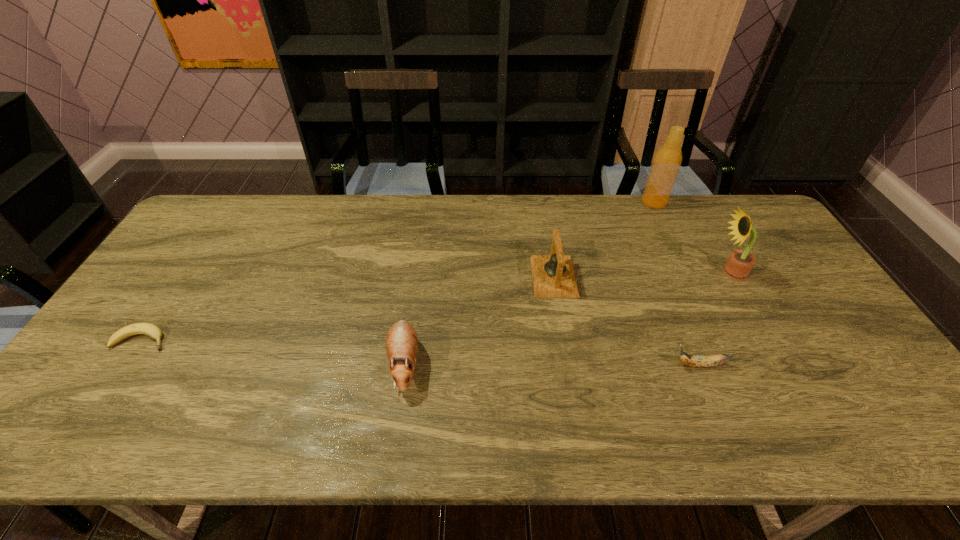
The image size is (960, 540). I want to click on object that is at the left edge, so click(x=151, y=330).

In the image, there is a desktop. Identify the location of vacant space at the far edge. Image resolution: width=960 pixels, height=540 pixels. (665, 208).

The height and width of the screenshot is (540, 960). Identify the location of free space at the near edge of the desktop. (198, 433).

The width and height of the screenshot is (960, 540). I want to click on free space at the left edge, so click(126, 310).

In the image, there is a desktop. Where is `vacant space at the right edge`? Image resolution: width=960 pixels, height=540 pixels. vacant space at the right edge is located at coordinates (787, 252).

At what (x,y) coordinates should I click in order to perform the action: click on free point at the far left corner. Please return your answer as a coordinate pair (x, y). This screenshot has height=540, width=960. Looking at the image, I should click on (234, 214).

Locate an element on the screen. The image size is (960, 540). vacant space at the far right corner of the desktop is located at coordinates coord(745,196).

The image size is (960, 540). Identify the location of vacant space at the near right corner. (863, 416).

Find the location of a particular element. This screenshot has height=540, width=960. empty space between the rightmost object and the bell is located at coordinates (642, 274).

This screenshot has height=540, width=960. In order to click on unoccupied position between the second shortest object and the farthest object in this screenshot , I will do `click(677, 284)`.